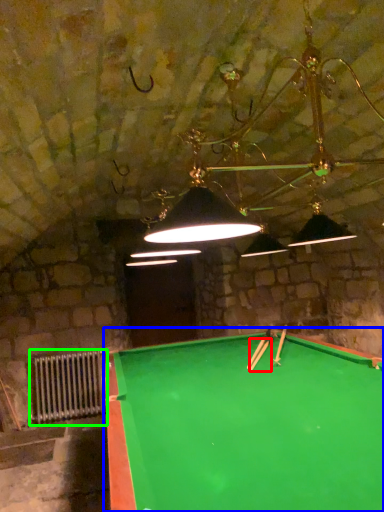
Question: Which object is positioned farthest from cue (highlighted by a red box)? Select from billiard table (highlighted by a blue box) and radiator (highlighted by a green box).

Choices:
 (A) billiard table
 (B) radiator

Answer: (B)